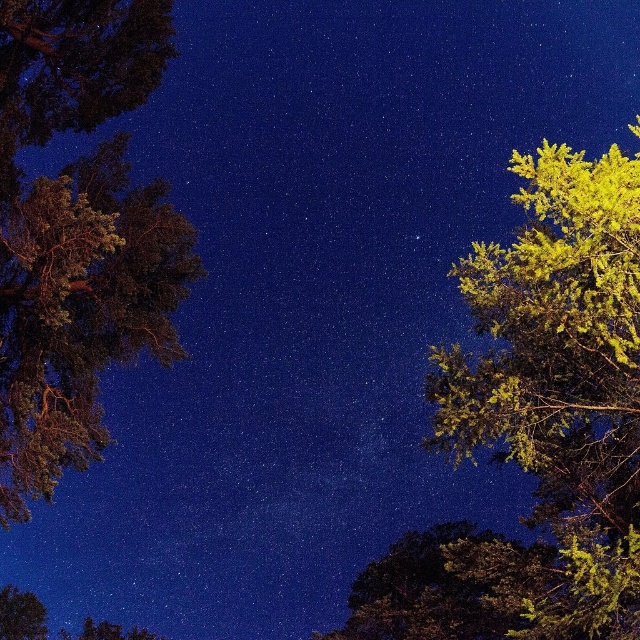
Question: Is green leafy tree at right above dark green textured tree at left?

Choices:
 (A) yes
 (B) no

Answer: (B)

Question: Which point is closer to the camera?

Choices:
 (A) (1, 435)
 (B) (547, 388)

Answer: (B)

Question: Which object appears farthest from the camera in this image?

Choices:
 (A) dark green textured tree at left
 (B) green leafy tree at right

Answer: (A)

Question: Is green leafy tree at right further to camera compared to dark green textured tree at left?

Choices:
 (A) no
 (B) yes

Answer: (A)

Question: Which point is closer to the camera?

Choices:
 (A) green leafy tree at right
 (B) dark green textured tree at left

Answer: (A)

Question: Is green leafy tree at right above dark green textured tree at left?

Choices:
 (A) yes
 (B) no

Answer: (B)